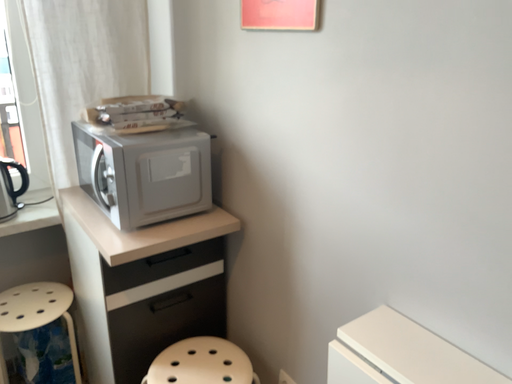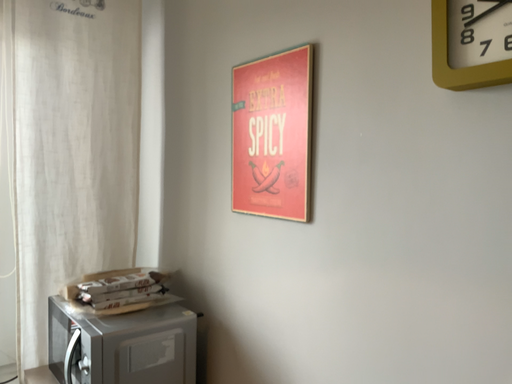
Question: How did the camera likely rotate when shooting the video?

Choices:
 (A) rotated upward
 (B) rotated downward

Answer: (A)